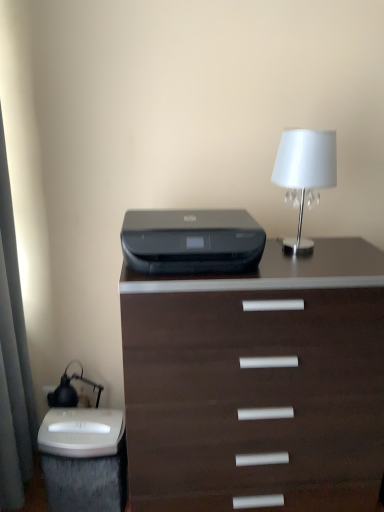
Question: From the image's perspective, is white plastic electric outlet at lower left on dark wood chest of drawers at center?

Choices:
 (A) yes
 (B) no

Answer: (B)

Question: Can you confirm if white plastic electric outlet at lower left is shorter than dark wood chest of drawers at center?

Choices:
 (A) yes
 (B) no

Answer: (A)

Question: Is white plastic electric outlet at lower left thinner than dark wood chest of drawers at center?

Choices:
 (A) yes
 (B) no

Answer: (A)

Question: Does white plastic electric outlet at lower left contain dark wood chest of drawers at center?

Choices:
 (A) no
 (B) yes

Answer: (A)

Question: Is white plastic electric outlet at lower left far from dark wood chest of drawers at center?

Choices:
 (A) yes
 (B) no

Answer: (A)

Question: Considering the positions of white glossy lampshade at upper right and black plastic printer at center in the image, is white glossy lampshade at upper right bigger or smaller than black plastic printer at center?

Choices:
 (A) small
 (B) big

Answer: (A)

Question: From a real-world perspective, is white glossy lampshade at upper right positioned above or below black plastic printer at center?

Choices:
 (A) below
 (B) above

Answer: (B)

Question: Do you think white glossy lampshade at upper right is within black plastic printer at center, or outside of it?

Choices:
 (A) inside
 (B) outside

Answer: (B)

Question: Is point (324, 168) closer or farther from the camera than point (175, 249)?

Choices:
 (A) closer
 (B) farther

Answer: (B)

Question: In terms of height, does white plastic electric outlet at lower left look taller or shorter compared to white glossy lampshade at upper right?

Choices:
 (A) short
 (B) tall

Answer: (A)

Question: Relative to white glossy lampshade at upper right, is white plastic electric outlet at lower left in front or behind?

Choices:
 (A) front
 (B) behind

Answer: (B)

Question: Based on their sizes in the image, would you say white plastic electric outlet at lower left is bigger or smaller than white glossy lampshade at upper right?

Choices:
 (A) small
 (B) big

Answer: (A)

Question: From the image's perspective, relative to white glossy lampshade at upper right, is white plastic electric outlet at lower left above or below?

Choices:
 (A) above
 (B) below

Answer: (B)

Question: Would you say white glossy lampshade at upper right is to the left or to the right of white plastic electric outlet at lower left in the picture?

Choices:
 (A) right
 (B) left

Answer: (A)

Question: From a real-world perspective, is white glossy lampshade at upper right above or below white plastic electric outlet at lower left?

Choices:
 (A) below
 (B) above

Answer: (B)